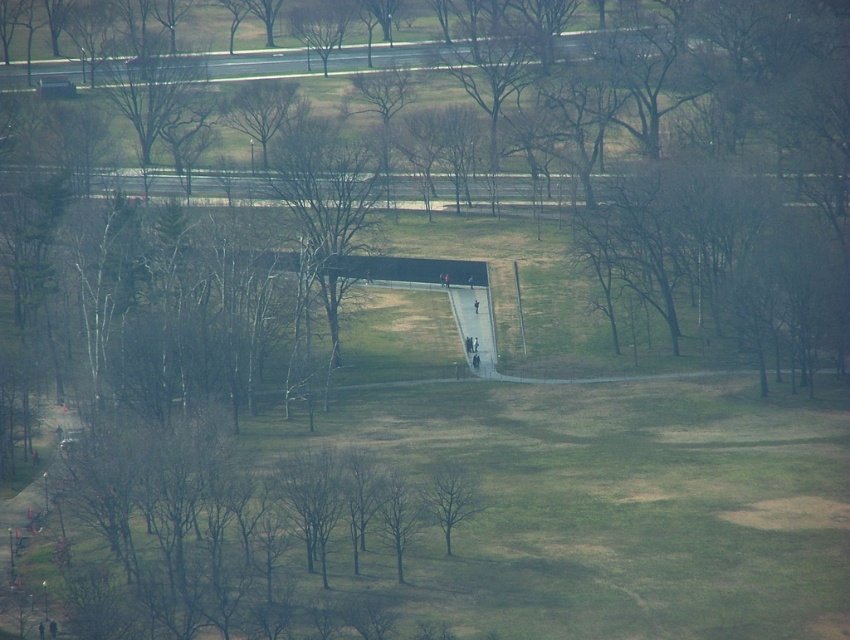
Question: Which of the following is the closest to the observer?

Choices:
 (A) bare branches at center
 (B) green leafy tree at center

Answer: (B)

Question: Which point is farther to the camera?

Choices:
 (A) (228, 100)
 (B) (479, 483)

Answer: (A)

Question: Does bare branches at center have a larger size compared to green leafy tree at center?

Choices:
 (A) no
 (B) yes

Answer: (B)

Question: Is bare branches at center thinner than green leafy tree at center?

Choices:
 (A) yes
 (B) no

Answer: (B)

Question: Does bare branches at center appear on the right side of green leafy tree at center?

Choices:
 (A) yes
 (B) no

Answer: (B)